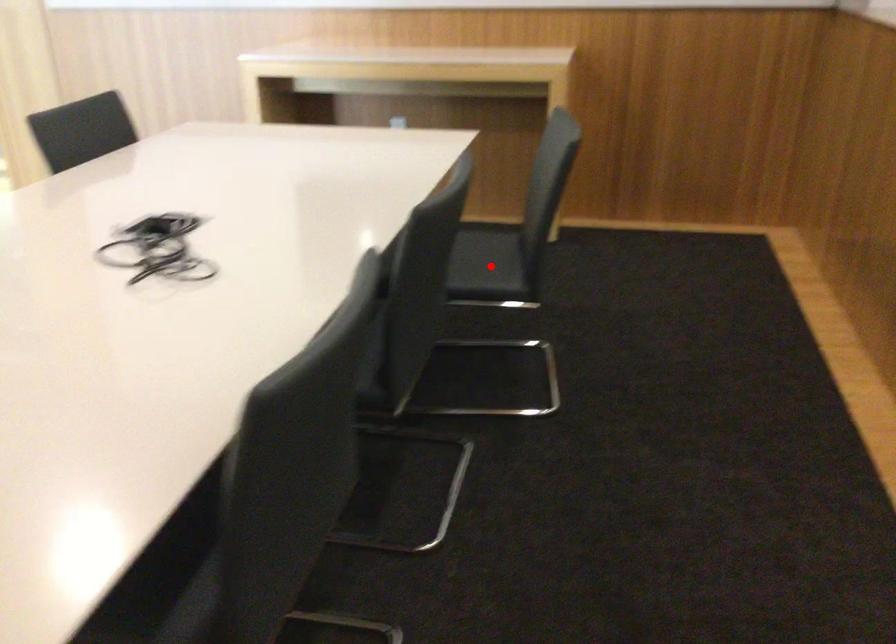
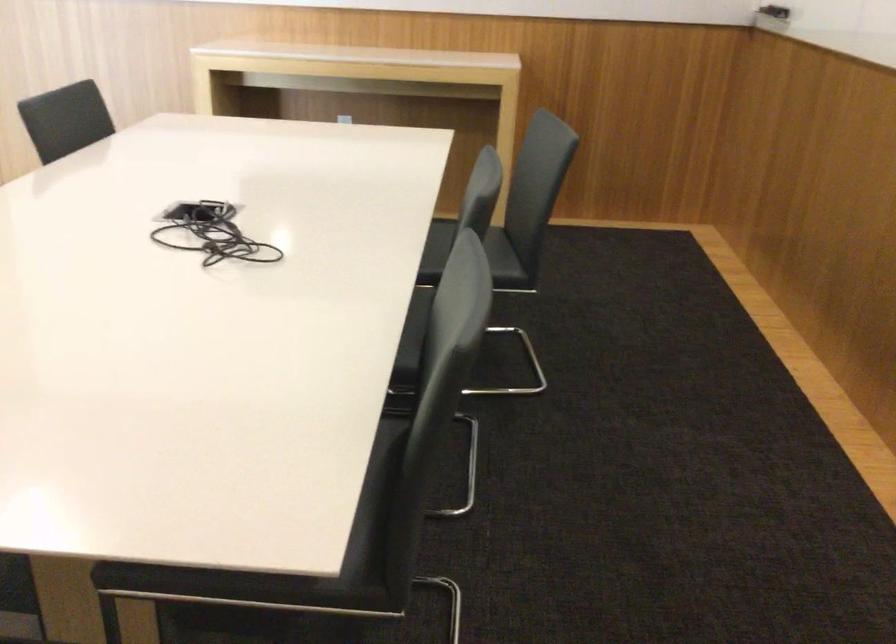
Question: I am providing you with two images of the same scene from different viewpoints. A red point is marked on the first image. Can you still see the location of the red point in image 2?

Choices:
 (A) Yes
 (B) No

Answer: (B)